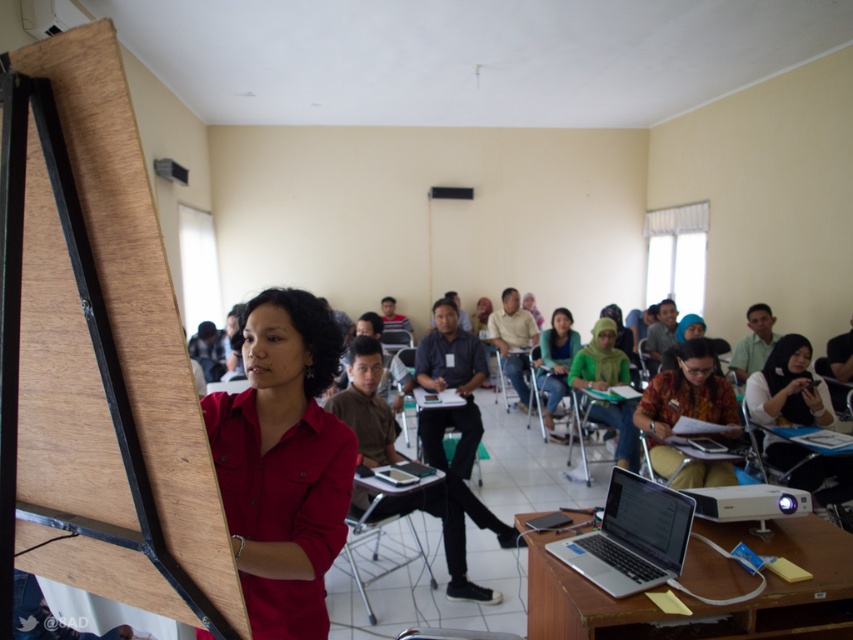
The height and width of the screenshot is (640, 853). What do you see at coordinates (700, 600) in the screenshot?
I see `silver metallic table at lower right` at bounding box center [700, 600].

Can you confirm if silver metallic table at lower right is positioned to the right of matte green shirt at center?

In fact, silver metallic table at lower right is to the left of matte green shirt at center.

You are a GUI agent. You are given a task and a screenshot of the screen. Output one action in this format:
    pyautogui.click(x=<x>, y=<y>)
    Task: Click on the silver metallic table at lower right
    The height and width of the screenshot is (640, 853).
    Given the screenshot: What is the action you would take?
    pyautogui.click(x=700, y=600)

From the picture: Can you confirm if matte black hijab at center is positioned below matte green shirt at center?

Yes, matte black hijab at center is below matte green shirt at center.

Is point (836, 499) positioned before point (634, 436)?

Yes, point (836, 499) is closer to viewer.

The image size is (853, 640). What do you see at coordinates (786, 387) in the screenshot?
I see `matte black hijab at center` at bounding box center [786, 387].

I want to click on matte black hijab at center, so click(786, 387).

Can you confirm if matte red shirt at center is taller than silver metallic table at lower right?

Yes, matte red shirt at center is taller than silver metallic table at lower right.

Does point (321, 444) come in front of point (660, 618)?

Yes, point (321, 444) is in front of point (660, 618).

Describe the element at coordinates (283, 464) in the screenshot. I see `matte red shirt at center` at that location.

I want to click on matte red shirt at center, so click(283, 464).